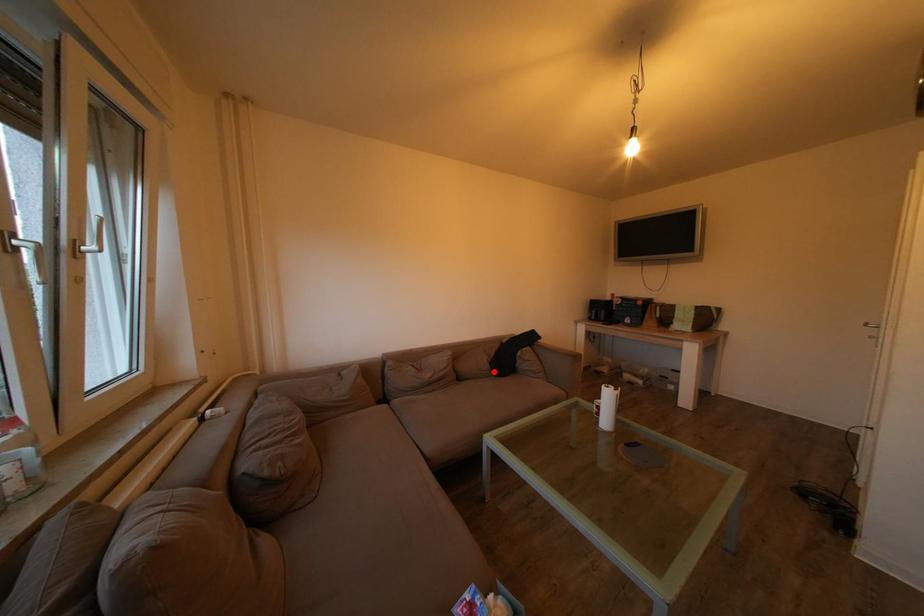
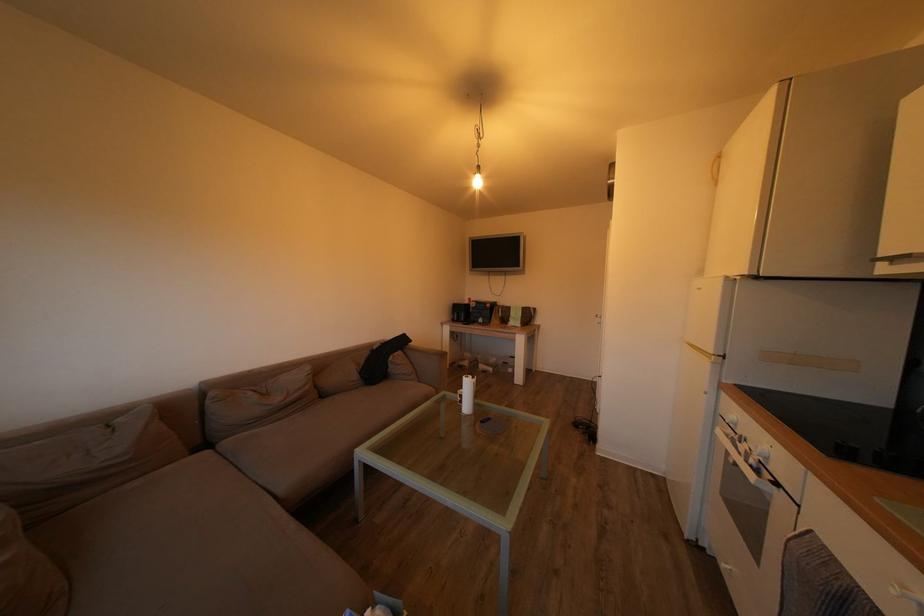
In the second image, find the point that corresponds to the highlighted location in the first image.

(362, 382)